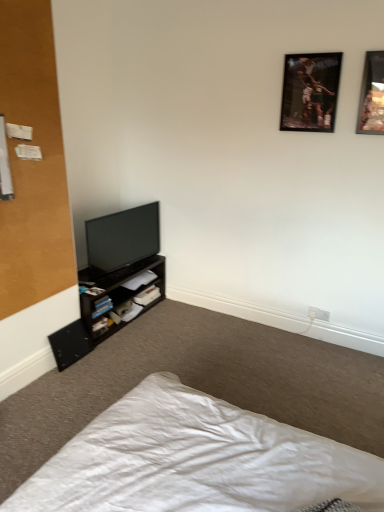
Question: Is white matte book at lower left, acting as the third book starting from the bottom, surrounding white fabric bed at lower left?

Choices:
 (A) no
 (B) yes

Answer: (A)

Question: Are white matte book at lower left, which appears as the 1th book when viewed from the top, and white fabric bed at lower left far apart?

Choices:
 (A) no
 (B) yes

Answer: (B)

Question: Is white matte book at lower left, which appears as the 1th book when viewed from the top, placed right next to white fabric bed at lower left?

Choices:
 (A) no
 (B) yes

Answer: (A)

Question: Is white matte book at lower left, which appears as the 1th book when viewed from the top, to the right of white fabric bed at lower left from the viewer's perspective?

Choices:
 (A) yes
 (B) no

Answer: (B)

Question: From a real-world perspective, is white matte book at lower left, acting as the third book starting from the bottom, physically above white fabric bed at lower left?

Choices:
 (A) yes
 (B) no

Answer: (A)

Question: Is white matte book at lower left, acting as the third book starting from the bottom, facing away from white fabric bed at lower left?

Choices:
 (A) yes
 (B) no

Answer: (B)

Question: Is wooden-framed picture at upper right, the 2th picture frame in the right-to-left sequence, positioned far away from hardcover book at lower left, which appears as the third book when viewed from the top?

Choices:
 (A) no
 (B) yes

Answer: (B)

Question: From a real-world perspective, does wooden-framed picture at upper right, the first picture frame in the left-to-right sequence, stand above hardcover book at lower left, the 1th book positioned from the bottom?

Choices:
 (A) no
 (B) yes

Answer: (B)

Question: Considering the relative sizes of wooden-framed picture at upper right, the first picture frame in the left-to-right sequence, and hardcover book at lower left, the 1th book positioned from the bottom, in the image provided, is wooden-framed picture at upper right, the first picture frame in the left-to-right sequence, thinner than hardcover book at lower left, the 1th book positioned from the bottom,?

Choices:
 (A) yes
 (B) no

Answer: (A)

Question: Does wooden-framed picture at upper right, the first picture frame in the left-to-right sequence, come in front of hardcover book at lower left, the 1th book positioned from the bottom?

Choices:
 (A) yes
 (B) no

Answer: (A)

Question: Considering the relative positions of wooden-framed picture at upper right, the first picture frame in the left-to-right sequence, and hardcover book at lower left, which appears as the third book when viewed from the top, in the image provided, is wooden-framed picture at upper right, the first picture frame in the left-to-right sequence, to the right of hardcover book at lower left, which appears as the third book when viewed from the top, from the viewer's perspective?

Choices:
 (A) yes
 (B) no

Answer: (A)

Question: From the image's perspective, is wooden-framed picture at upper right, the 2th picture frame in the right-to-left sequence, below hardcover book at lower left, the 1th book positioned from the bottom?

Choices:
 (A) yes
 (B) no

Answer: (B)

Question: Is wooden-framed picture at upper right, the first picture frame in the left-to-right sequence, positioned in front of white fabric bed at lower left?

Choices:
 (A) yes
 (B) no

Answer: (B)